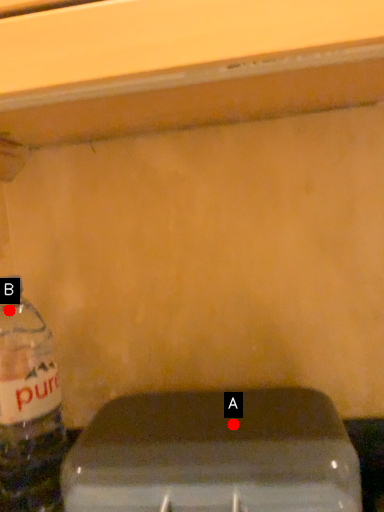
Question: Two points are circled on the image, labeled by A and B beside each circle. Which point is closer to the camera?

Choices:
 (A) A is closer
 (B) B is closer

Answer: (A)